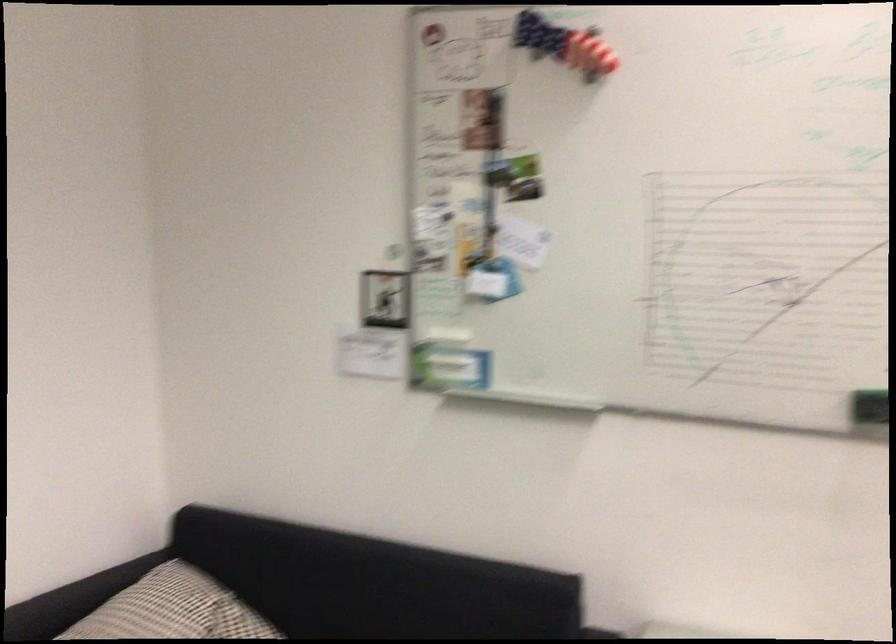
Image resolution: width=896 pixels, height=644 pixels. Describe the element at coordinates (193, 612) in the screenshot. I see `a sofa sitting surface` at that location.